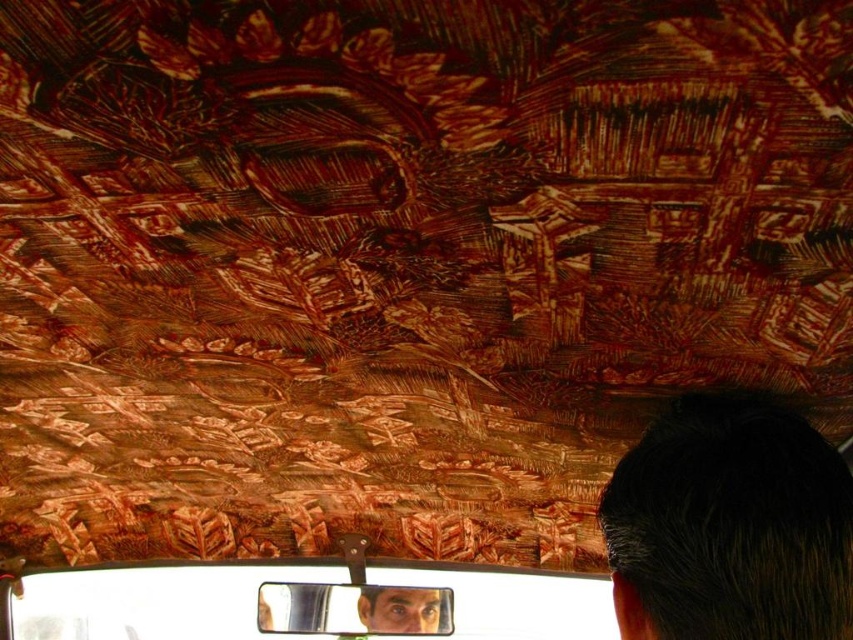
You are a passenger in a bus and you want to place your hat on the ceiling. The hat requires 36 inches of space. Can you place it between the dark brown hair at upper right and the rearview mirror at bottom center?

The distance between the dark brown hair at upper right and the rearview mirror at bottom center is 35.55 inches. Since the hat requires 36 inches of space, it will not fit in that area.

You are a passenger in a bus and see the dark brown hair at upper right and the metallic reflective mirror at center. Which object is closer to you?

The dark brown hair at upper right is closer to you because it is in front of the metallic reflective mirror at center.

You are a passenger in a vehicle and want to adjust your dark brown hair at upper right while looking at your reflection in the metallic reflective mirror at center. Can you reach both items at the same time if your arms can extend 1.5 meters?

The dark brown hair at upper right and metallic reflective mirror at center are 1.41 meters apart, so yes, you can reach both items at the same time since your arms can extend 1.5 meters which is longer than the distance between them.